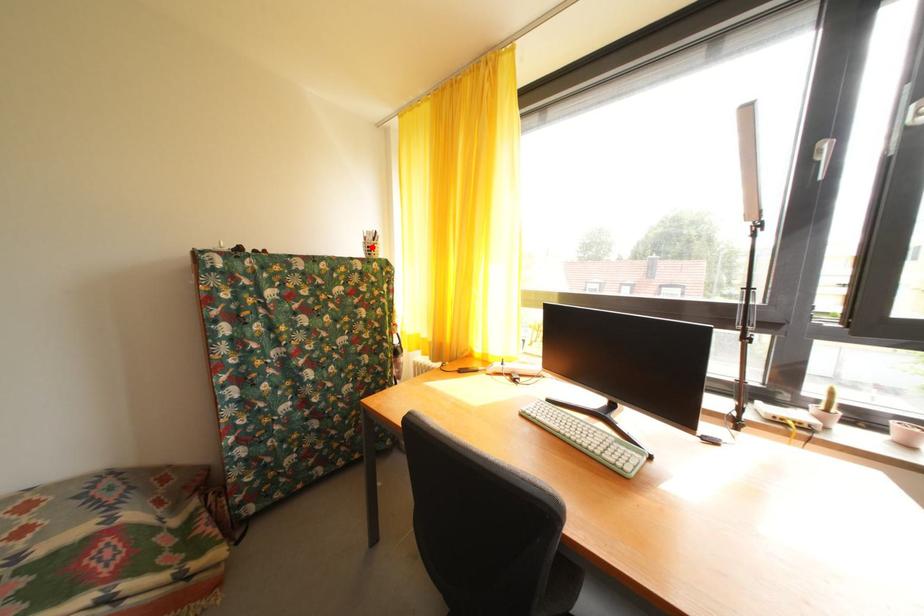
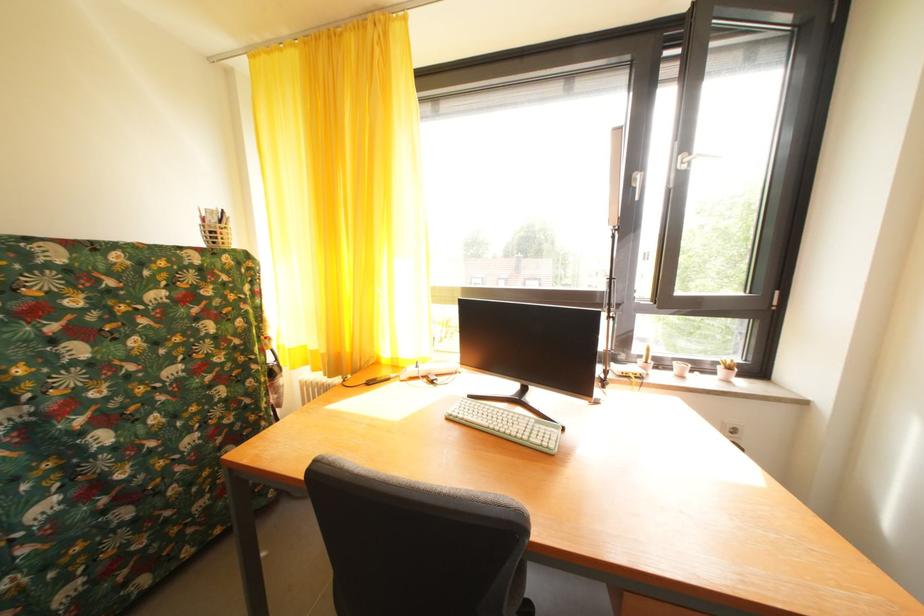
Where in the second image is the point corresponding to the highlighted location from the first image?

(209, 229)